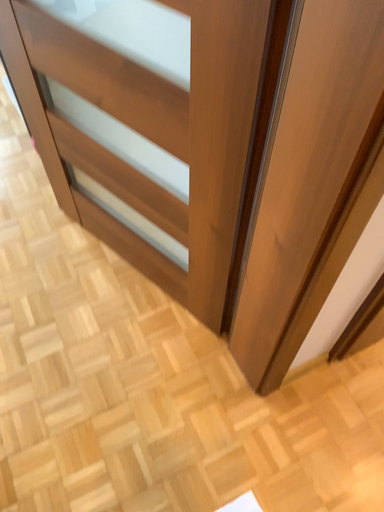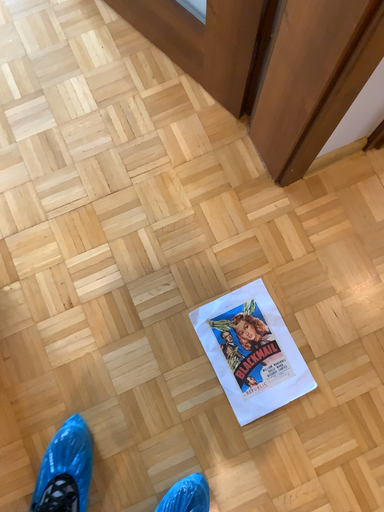
Question: Which way did the camera rotate in the video?

Choices:
 (A) rotated upward
 (B) rotated downward

Answer: (B)